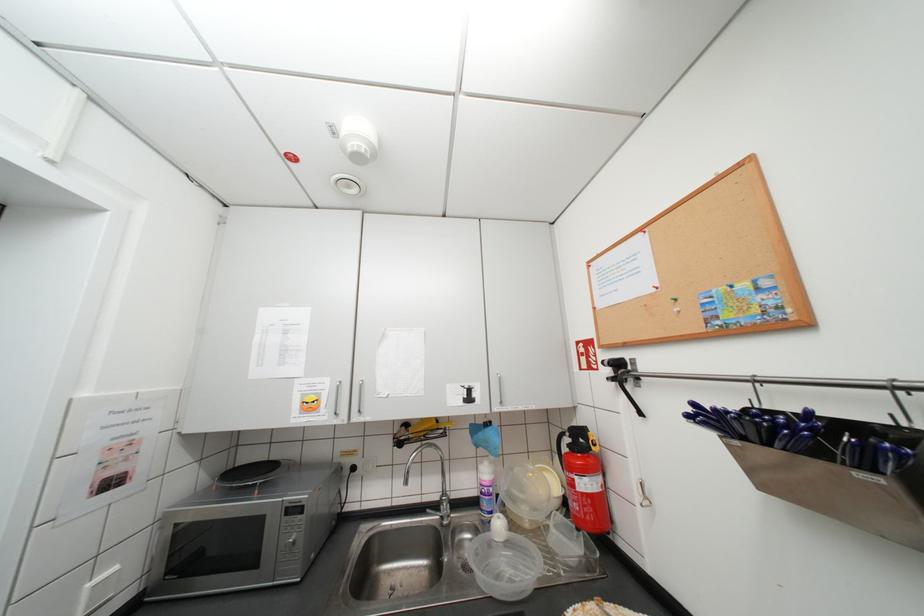
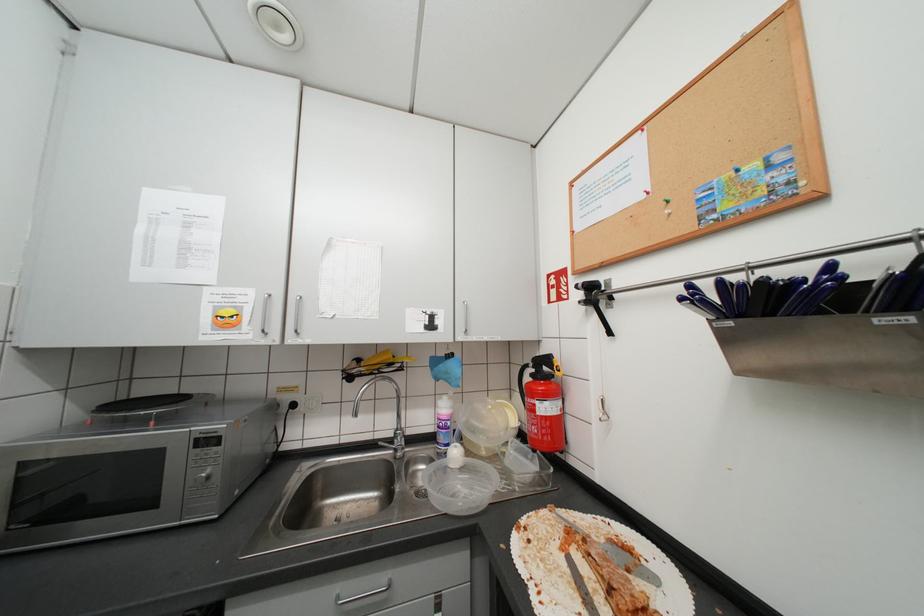
Question: How did the camera likely rotate?

Choices:
 (A) Left
 (B) Right
 (C) Up
 (D) Down

Answer: (B)